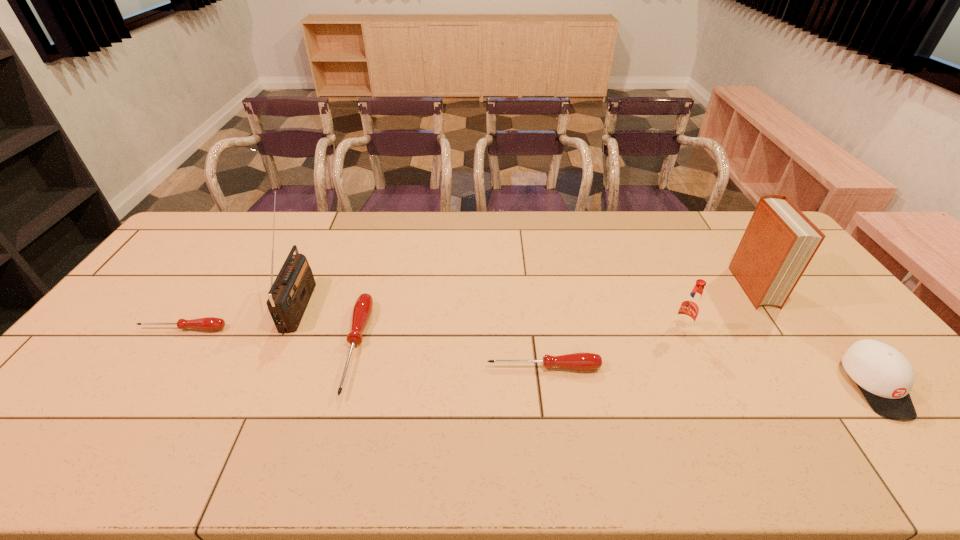
Locate an element on the screen. This screenshot has height=540, width=960. screwdriver that is the closest to the sixth tallest object is located at coordinates (362, 309).

The image size is (960, 540). What are the coordinates of `screwdriver that stands as the second closest to the sixth tallest object` in the screenshot? It's located at (209, 323).

This screenshot has width=960, height=540. In order to click on vacant space that satisfies the following two spatial constraints: 1. on the open cover of the hardback book; 2. on the front-facing side of the second object from left to right in this screenshot , I will do `click(764, 303)`.

The height and width of the screenshot is (540, 960). Identify the location of blank area in the image that satisfies the following two spatial constraints: 1. on the open cover of the hardback book; 2. on the front-facing side of the second object from left to right. (764, 303).